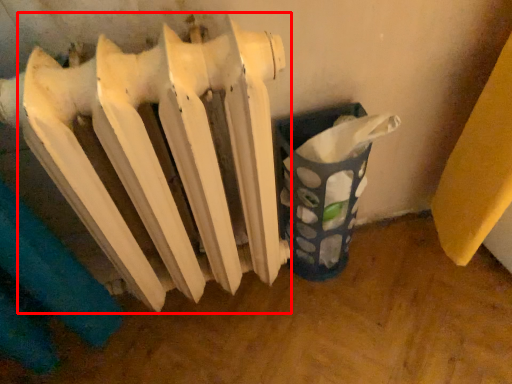
Question: Observing the image, what is the correct spatial positioning of radiator (annotated by the red box) in reference to waste container?

Choices:
 (A) right
 (B) left

Answer: (B)